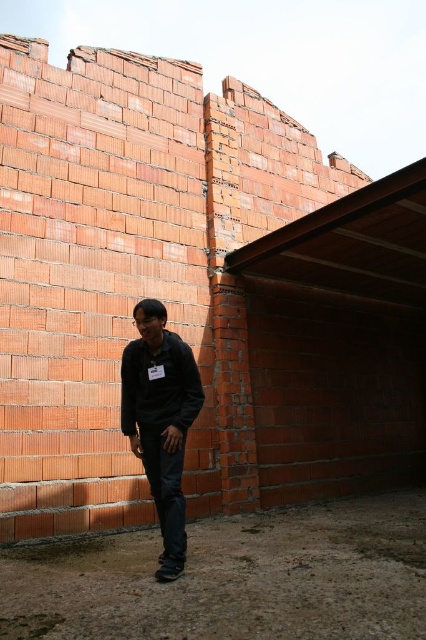
You are a photographer trying to capture the best angle of the partially constructed brick wall. You notice two points marked on the wall at coordinates point (189, 358) and point (164, 385). Which point should you focus on to ensure it appears closer to the camera in your photo?

Point (189, 358) is further to the camera than point (164, 385), so focusing on point (189, 358) will make it appear closer in the photo.

You are a fashion designer observing the scene and need to determine if two garments can be displayed together on a mannequin. The black matte jacket at center and the dark matte sweatshirt at center are both in the center of the image. Given that the mannequin has a width of 5 inches, can both garments fit side by side without overlapping?

The black matte jacket at center is 4.68 inches from the dark matte sweatshirt at center, so yes, both garments can fit side by side on the mannequin since the total space between them is less than the mannequin width of 5 inches.

You are a fashion designer observing a person wearing both the black matte jacket at center and the dark matte sweatshirt at center. Which clothing item would you need to adjust to ensure it fits better over the other?

The black matte jacket at center has a larger width than the dark matte sweatshirt at center, so you would need to adjust the black matte jacket at center to ensure it fits properly over the dark matte sweatshirt at center.